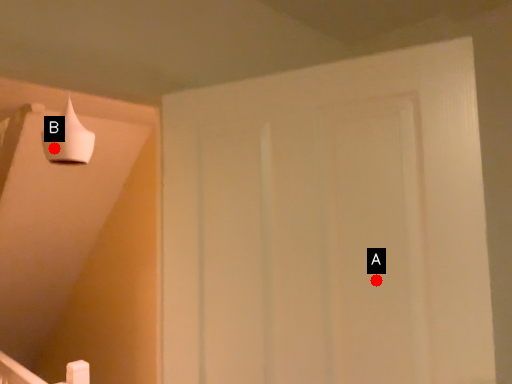
Question: Two points are circled on the image, labeled by A and B beside each circle. Which point is closer to the camera taking this photo?

Choices:
 (A) A is closer
 (B) B is closer

Answer: (A)